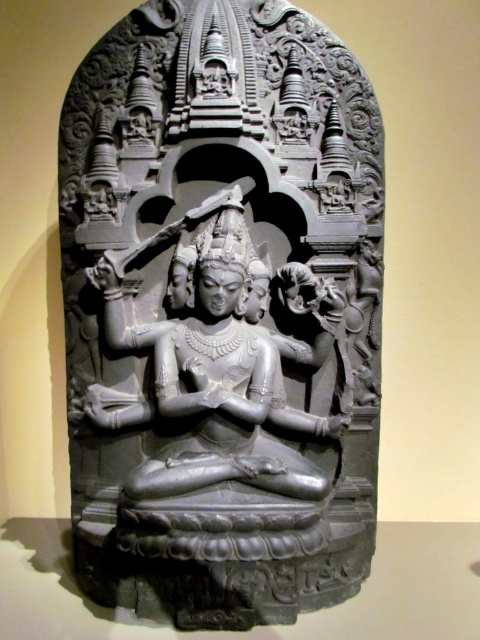
Who is higher up, black stone statue at center or gray stone statue at center?

black stone statue at center

Does black stone statue at center appear over gray stone statue at center?

Correct, black stone statue at center is located above gray stone statue at center.

Which is behind, point (207, 442) or point (193, 369)?

Point (207, 442)

Identify the location of black stone statue at center. This screenshot has width=480, height=640. (222, 314).